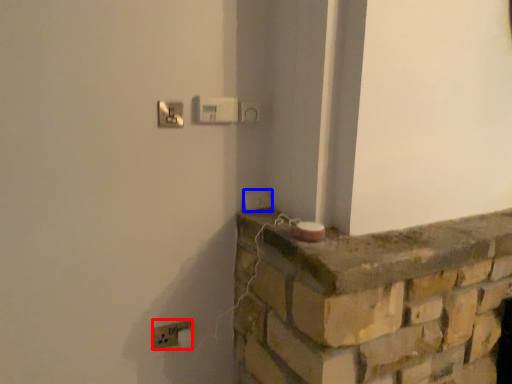
Question: Among these objects, which one is nearest to the camera, electric outlet (highlighted by a red box) or light switch (highlighted by a blue box)?

Choices:
 (A) electric outlet
 (B) light switch

Answer: (A)